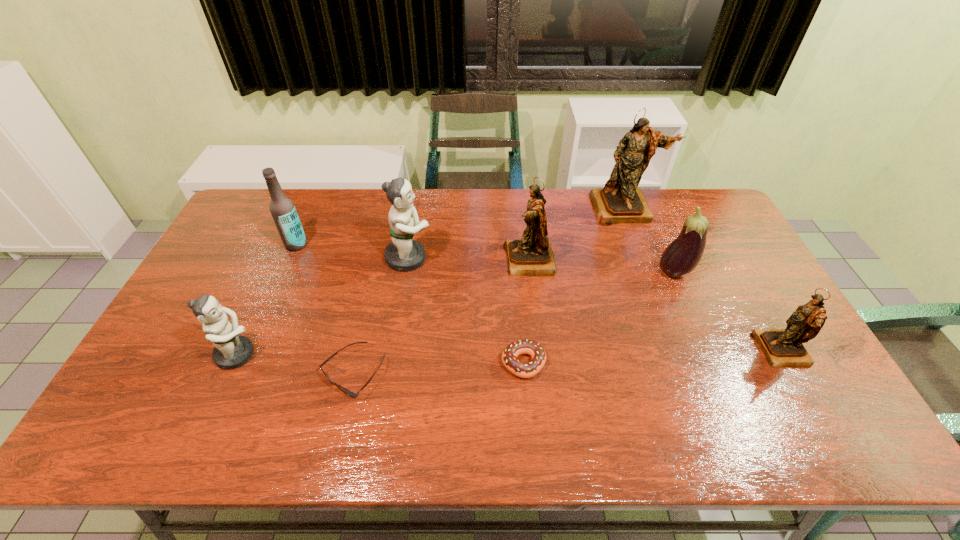
What are the coordinates of `vacant region that satisfies the following two spatial constraints: 1. on the front-facing side of the farthest figurine; 2. on the front-facing side of the farther green figurine` in the screenshot? It's located at (641, 258).

At what (x,y) coordinates should I click in order to perform the action: click on vacant area that satisfies the following two spatial constraints: 1. on the front-facing side of the farther green figurine; 2. at the front of the blue sunglasses showing the lenses. Please return your answer as a coordinate pair (x, y). Image resolution: width=960 pixels, height=540 pixels. Looking at the image, I should click on (391, 373).

I want to click on vacant space that satisfies the following two spatial constraints: 1. on the front-facing side of the farthest figurine; 2. on the front-facing side of the second smallest gold figurine, so click(x=642, y=260).

The height and width of the screenshot is (540, 960). I want to click on vacant space that satisfies the following two spatial constraints: 1. on the front-facing side of the third figurine from left to right; 2. on the right side of the eggplant, so click(x=531, y=273).

At what (x,y) coordinates should I click in order to perform the action: click on free space that satisfies the following two spatial constraints: 1. on the front-facing side of the tallest figurine; 2. on the left side of the eggplant. Please return your answer as a coordinate pair (x, y). Looking at the image, I should click on (647, 273).